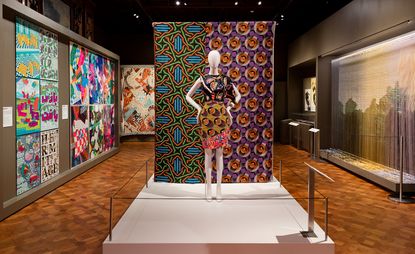
Where is `art`? The height and width of the screenshot is (254, 415). art is located at coordinates (28, 103).